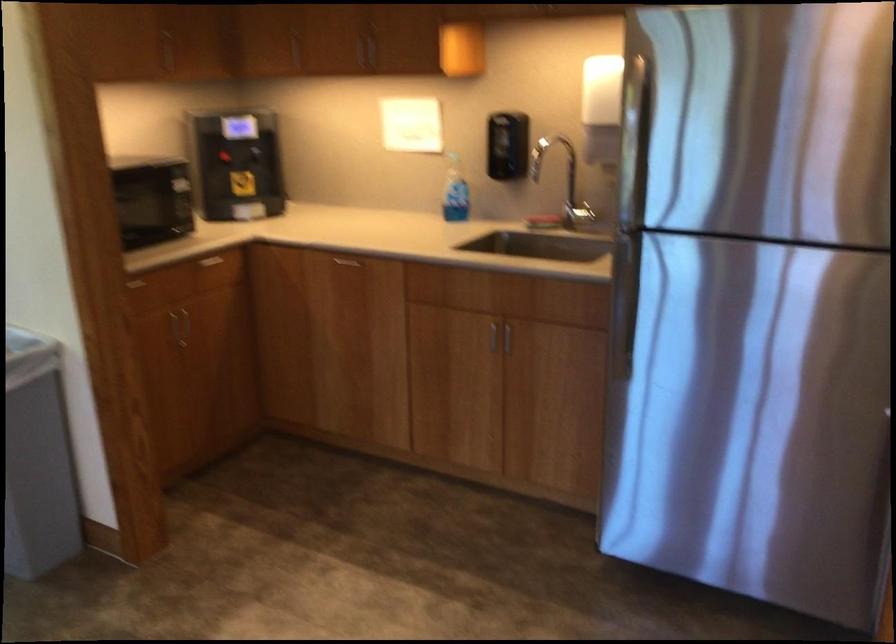
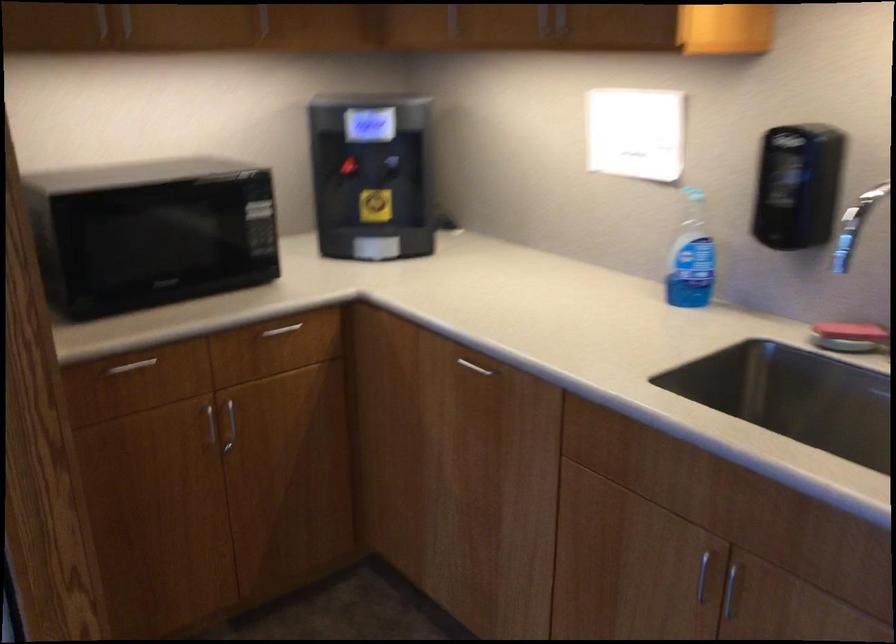
In the second image, find the point that corresponds to point (458, 187) in the first image.

(691, 257)